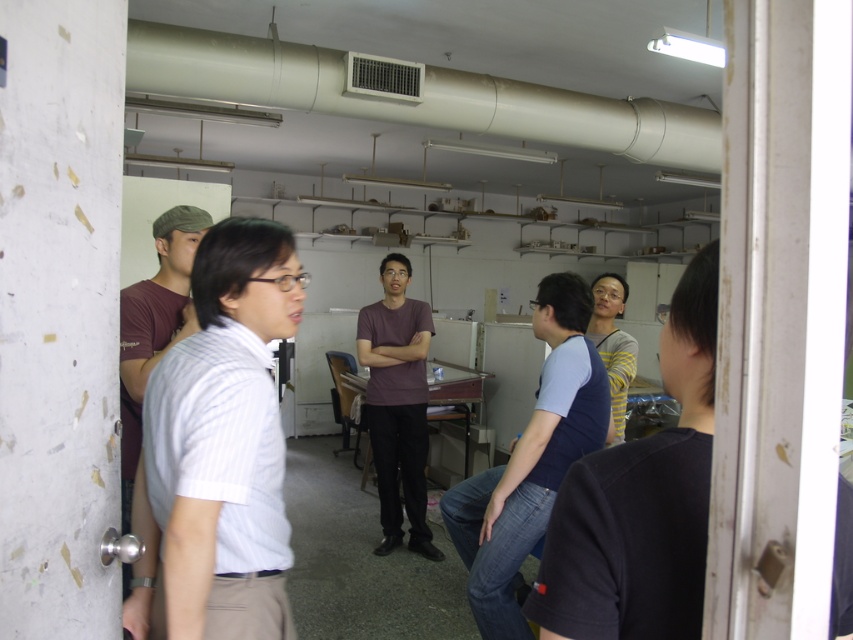
You are an observer standing in the room. You notice the blue denim jeans at center and the purple matte shirt at center. Which one is positioned higher in the image?

The blue denim jeans at center is above the purple matte shirt at center, so it is positioned higher.

You are a photographer setting up a group photo in this room. You notice the white striped shirt at left and the purple matte shirt at center. Which shirt should you adjust to ensure both are visible in the frame, considering their heights?

The white striped shirt at left is shorter than the purple matte shirt at center, so you should adjust the white striped shirt at left to ensure both are visible in the frame.